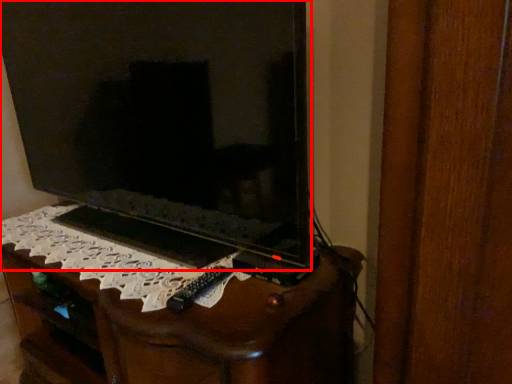
Question: Considering the relative positions of television (annotated by the red box) and furniture in the image provided, where is television (annotated by the red box) located with respect to the staircase?

Choices:
 (A) right
 (B) left

Answer: (B)